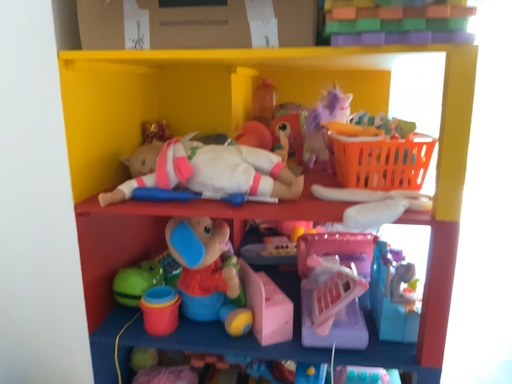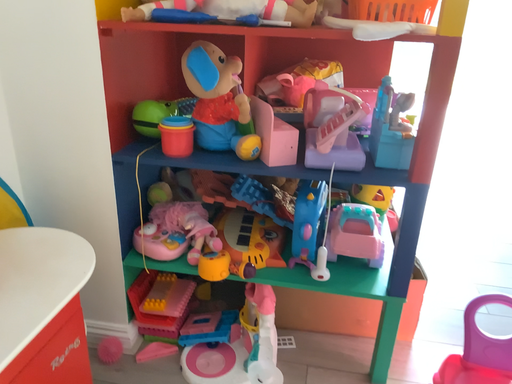
Question: How did the camera likely rotate when shooting the video?

Choices:
 (A) rotated downward
 (B) rotated upward

Answer: (A)